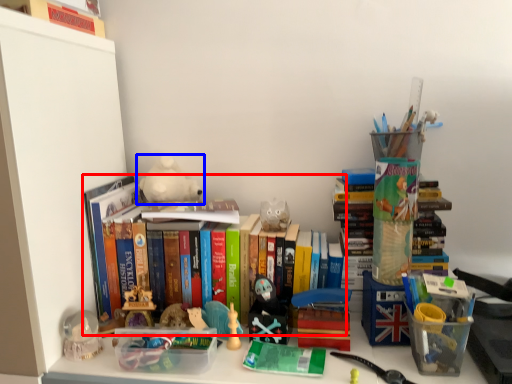
Question: Which object is closer to the camera taking this photo, book (highlighted by a red box) or toy (highlighted by a blue box)?

Choices:
 (A) book
 (B) toy

Answer: (A)